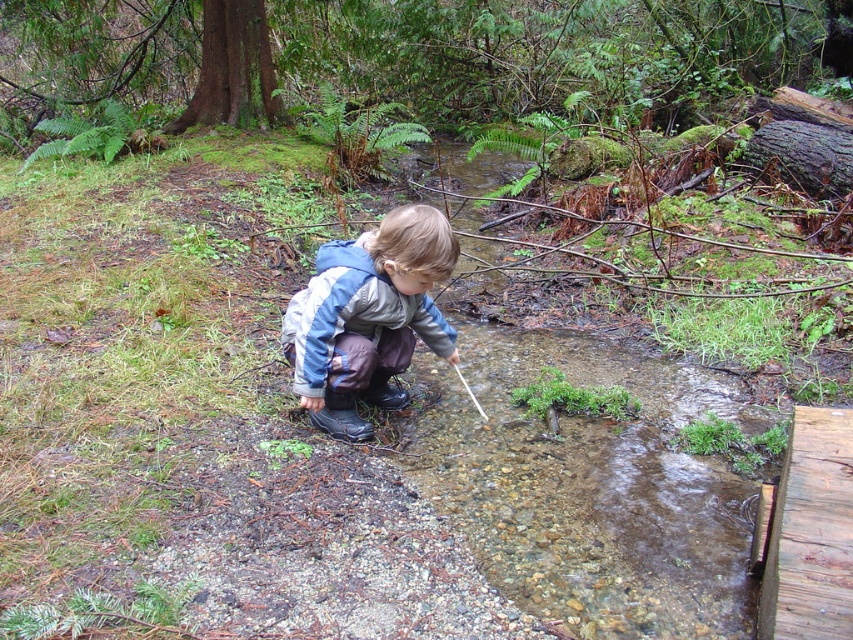
Is blue denim jacket at center shorter than weathered wooden plank at lower right?

No, blue denim jacket at center is not shorter than weathered wooden plank at lower right.

Which is in front, point (393, 326) or point (842, 442)?

Positioned in front is point (842, 442).

Where is `blue denim jacket at center`? Image resolution: width=853 pixels, height=640 pixels. blue denim jacket at center is located at coordinates (368, 317).